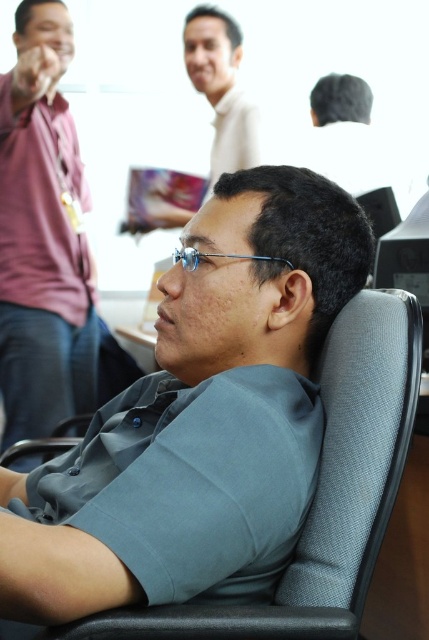
In the scene shown: Based on the scene description, where is the matte maroon shirt at left located in terms of coordinates?

The matte maroon shirt at left is located at coordinates point (x=42, y=236).

You are observing an office scene and notice two people wearing different colored shirts. The individuals are labeled as the matte maroon shirt at left and the matte white shirt at upper center. Which of these two shirts is taller in the image?

The matte maroon shirt at left is taller than the matte white shirt at upper center.

You are an office manager trying to arrange a meeting. You need to know which object takes up more visual space in the image between the matte maroon shirt at left and the dark gray fabric cap at upper right. Which one should you consider larger in the image?

The dark gray fabric cap at upper right occupies more visual space in the image than the matte maroon shirt at left, so you should consider it larger.